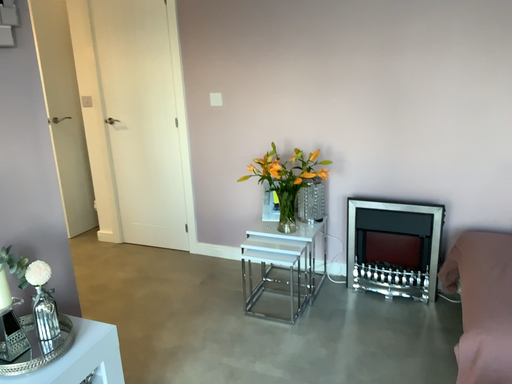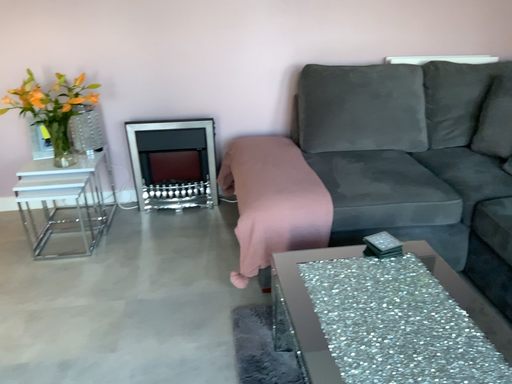
Question: Which way did the camera rotate in the video?

Choices:
 (A) rotated left
 (B) rotated right

Answer: (B)